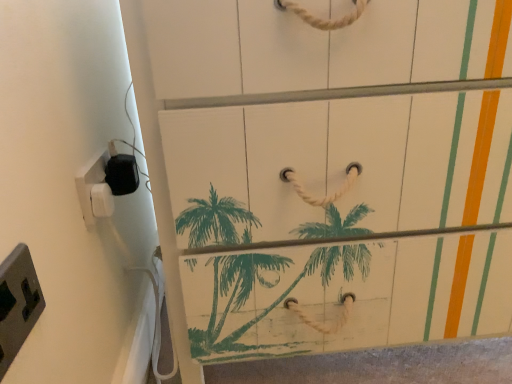
Question: Relative to white plastic/light switch at left, marked as the second light switch in a front-to-back arrangement, is white plastic/light switch at left, which appears as the first light switch when viewed from the back, in front or behind?

Choices:
 (A) front
 (B) behind

Answer: (B)

Question: From the image's perspective, is white plastic/light switch at left, which is counted as the third light switch, starting from the front, above or below white plastic/light switch at left, marked as the second light switch in a front-to-back arrangement?

Choices:
 (A) below
 (B) above

Answer: (A)

Question: Which is farther from the white plastic/light switch at left, which is counted as the third light switch, starting from the front?

Choices:
 (A) white plastic/light switch at left, which ranks as the second light switch in back-to-front order
 (B) gray plastic/light switch at lower left, acting as the third light switch starting from the back

Answer: (B)

Question: Which object is the farthest from the white plastic/light switch at left, which ranks as the second light switch in back-to-front order?

Choices:
 (A) gray plastic/light switch at lower left, acting as the third light switch starting from the back
 (B) white plastic/light switch at left, which is counted as the third light switch, starting from the front

Answer: (A)